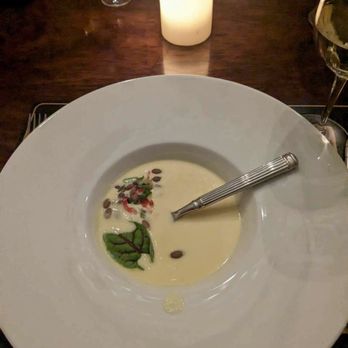
Where is `place mat`? The image size is (348, 348). place mat is located at coordinates (46, 106).